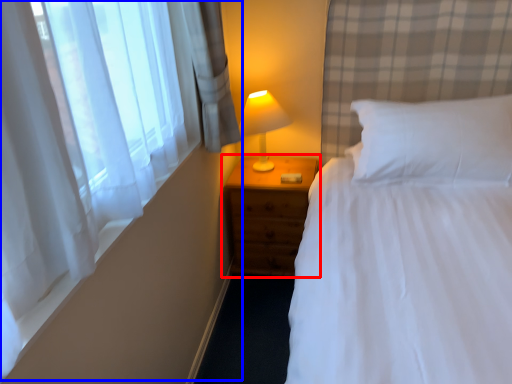
Question: Which of the following is the closest to the observer, nightstand (highlighted by a red box) or curtain (highlighted by a blue box)?

Choices:
 (A) nightstand
 (B) curtain

Answer: (B)